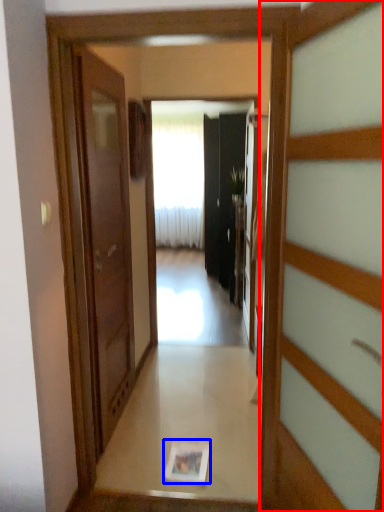
Question: Which of the following is the closest to the observer, door (highlighted by a red box) or magazine (highlighted by a blue box)?

Choices:
 (A) door
 (B) magazine

Answer: (A)